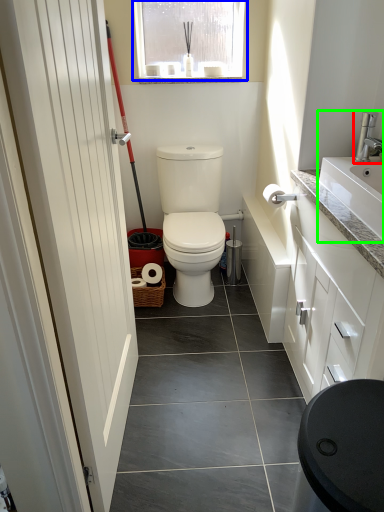
Question: Which object is positioned farthest from tap (highlighted by a red box)? Select from window (highlighted by a blue box) and sink (highlighted by a green box).

Choices:
 (A) window
 (B) sink

Answer: (A)